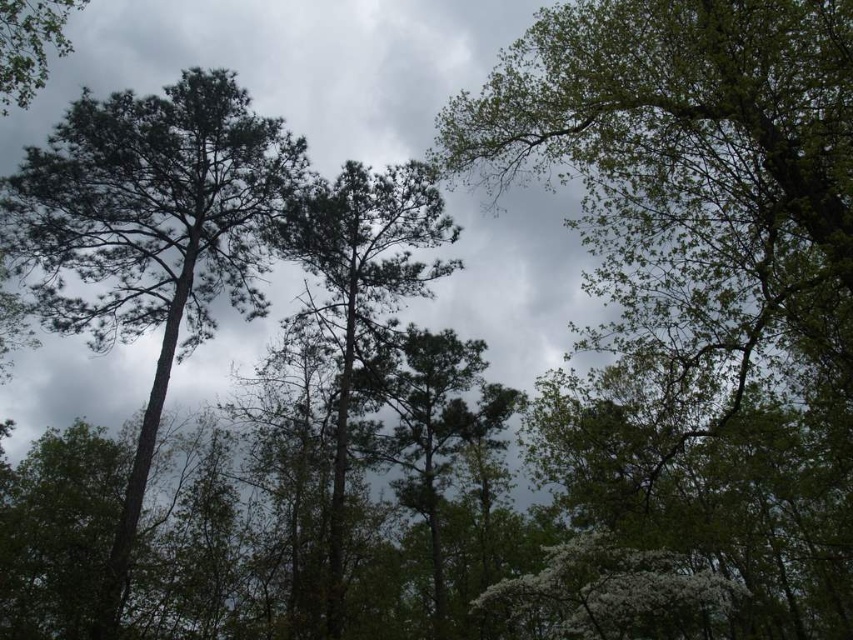
Question: Among these objects, which one is nearest to the camera?

Choices:
 (A) green leafy tree at upper left
 (B) green matte tree at center
 (C) green matte tree at left

Answer: (A)

Question: Is green matte tree at left positioned at the back of green matte tree at center?

Choices:
 (A) no
 (B) yes

Answer: (A)

Question: Which of the following is the closest to the observer?

Choices:
 (A) green matte tree at left
 (B) green leafy tree at upper left
 (C) green matte tree at center

Answer: (B)

Question: Which point is closer to the camera taking this photo?

Choices:
 (A) (183, 253)
 (B) (386, 380)
 (C) (3, 4)

Answer: (C)

Question: Can you confirm if green matte tree at center is wider than green leafy tree at upper left?

Choices:
 (A) yes
 (B) no

Answer: (A)

Question: Does green matte tree at left appear on the left side of green matte tree at center?

Choices:
 (A) yes
 (B) no

Answer: (A)